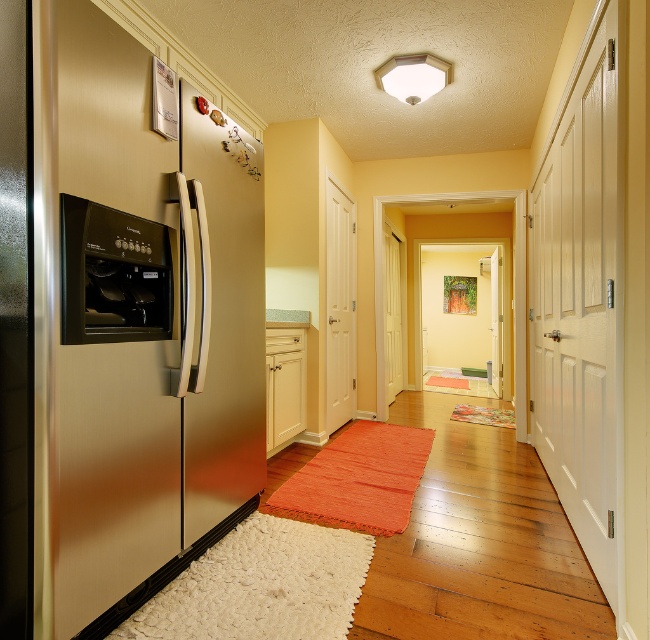
Is stainless steel refrigerator at left in front of satin black oven at left?

Yes, it is.

Consider the image. Is stainless steel refrigerator at left to the left of satin black oven at left from the viewer's perspective?

Incorrect, stainless steel refrigerator at left is not on the left side of satin black oven at left.

Is point (91, 538) positioned in front of point (157, 296)?

Yes.

This screenshot has width=650, height=640. I want to click on stainless steel refrigerator at left, so click(x=136, y=323).